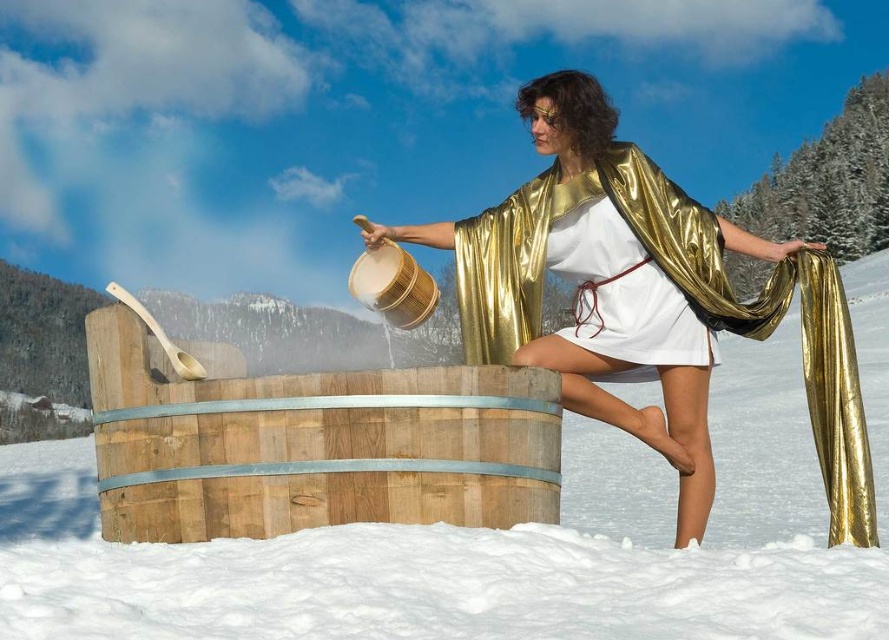
Question: Based on their relative distances, which object is nearer to the metallic gold robe at center?

Choices:
 (A) natural wood barrel at lower center
 (B) white fluffy snow at center

Answer: (A)

Question: Which of these objects is positioned closest to the white fluffy snow at center?

Choices:
 (A) natural wood barrel at lower center
 (B) metallic gold robe at center

Answer: (B)

Question: Is the position of white fluffy snow at center more distant than that of natural wood barrel at lower center?

Choices:
 (A) yes
 (B) no

Answer: (B)

Question: Can you confirm if natural wood barrel at lower center is smaller than metallic gold robe at center?

Choices:
 (A) yes
 (B) no

Answer: (A)

Question: Which point is closer to the camera taking this photo?

Choices:
 (A) (591, 300)
 (B) (308, 440)
 (C) (871, 280)

Answer: (B)

Question: Can you confirm if white fluffy snow at center is smaller than metallic gold robe at center?

Choices:
 (A) no
 (B) yes

Answer: (A)